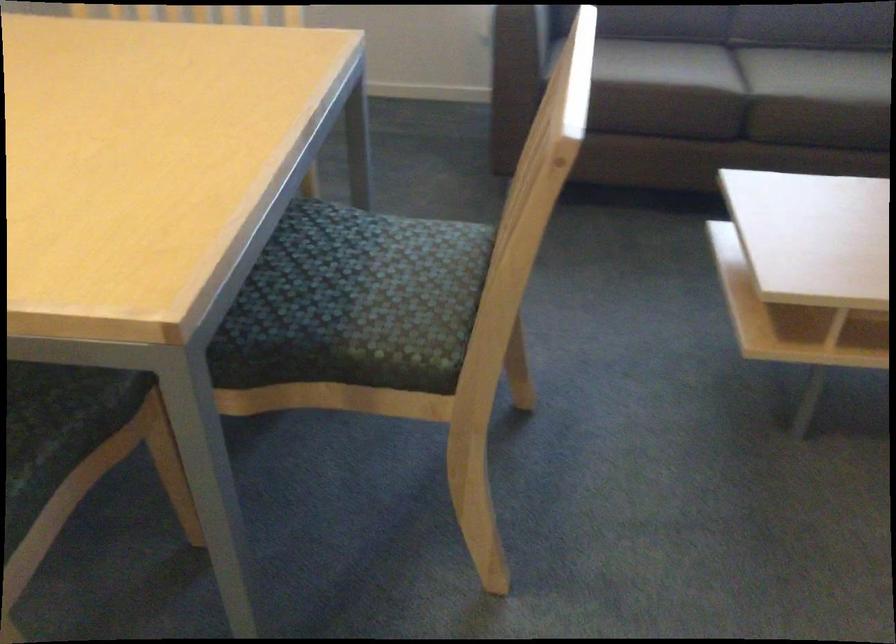
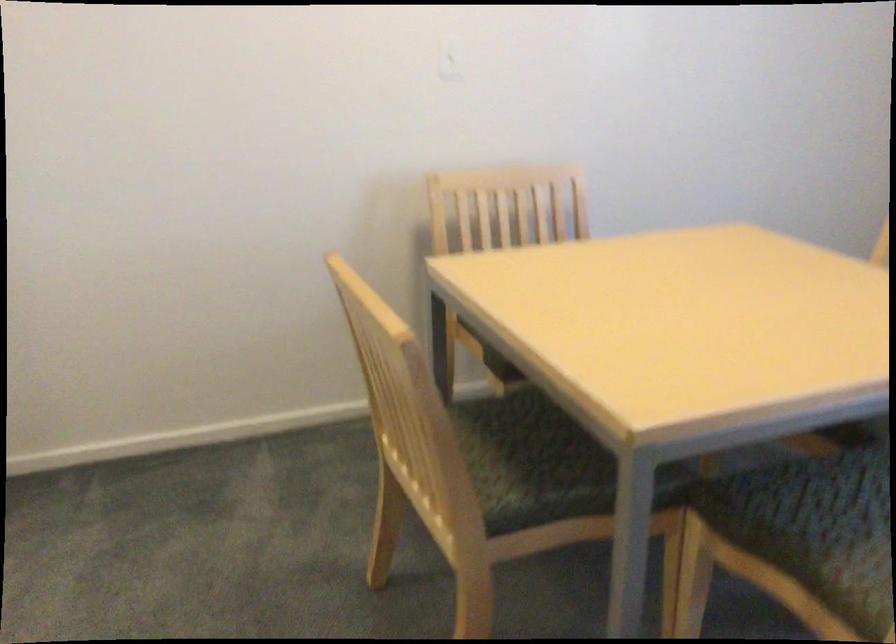
Question: How did the camera likely rotate?

Choices:
 (A) Left
 (B) Right
 (C) Up
 (D) Down

Answer: (A)